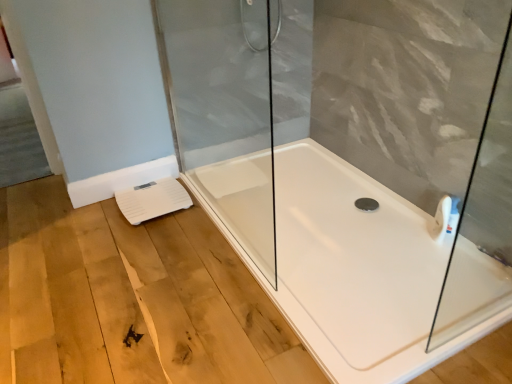
What do you see at coordinates (152, 200) in the screenshot?
I see `white plastic scale at lower left` at bounding box center [152, 200].

Measure the distance between white glossy bathtub at center and camera.

white glossy bathtub at center is 4.17 feet away from camera.

Describe the element at coordinates (223, 111) in the screenshot. I see `transparent glass shower door at center` at that location.

Find the location of `white plastic scale at lower left`. white plastic scale at lower left is located at coordinates (152, 200).

Considering the sizes of transparent glass shower door at center and white glossy bathtub at center in the image, is transparent glass shower door at center wider or thinner than white glossy bathtub at center?

In the image, transparent glass shower door at center appears to be more narrow than white glossy bathtub at center.

Which is closer to the camera, (213,155) or (322,289)?

Point (213,155) appears to be farther away from the viewer than point (322,289).

Is transparent glass shower door at center closer to the viewer compared to white glossy bathtub at center?

That is False.

From the image's perspective, is white plastic scale at lower left on white glossy bathtub at center?

Yes.

What's the angular difference between white plastic scale at lower left and white glossy bathtub at center's facing directions?

The facing directions of white plastic scale at lower left and white glossy bathtub at center are 88.8 degrees apart.

Is white plastic scale at lower left completely or partially outside of white glossy bathtub at center?

Yes, white plastic scale at lower left is not within white glossy bathtub at center.

Who is shorter, white plastic scale at lower left or transparent glass shower door at center?

With less height is white plastic scale at lower left.

What are the coordinates of `lift below the transparent glass shower door at center (from a real-world perspective)` in the screenshot? It's located at (152, 200).

From a real-world perspective, is white plastic scale at lower left positioned above or below transparent glass shower door at center?

white plastic scale at lower left is situated lower than transparent glass shower door at center in the real world.

How distant is white plastic scale at lower left from transparent glass shower door at center?

white plastic scale at lower left and transparent glass shower door at center are 20.19 inches apart.

Is transparent glass shower door at center turned away from white plastic scale at lower left?

Correct, transparent glass shower door at center is looking away from white plastic scale at lower left.

Between transparent glass shower door at center and white plastic scale at lower left, which one has less height?

With less height is white plastic scale at lower left.

Are transparent glass shower door at center and white plastic scale at lower left beside each other?

No, transparent glass shower door at center is not next to white plastic scale at lower left.

From the image's perspective, is transparent glass shower door at center under white plastic scale at lower left?

No, from the image's perspective, transparent glass shower door at center is not beneath white plastic scale at lower left.

From the image's perspective, which one is positioned higher, white glossy bathtub at center or white plastic scale at lower left?

From the image's view, white plastic scale at lower left is above.

Can you see white glossy bathtub at center touching white plastic scale at lower left?

No.

Is white glossy bathtub at center surrounding white plastic scale at lower left?

No, white plastic scale at lower left is located outside of white glossy bathtub at center.

Looking at this image, considering the positions of objects white glossy bathtub at center and white plastic scale at lower left in the image provided, who is more to the right, white glossy bathtub at center or white plastic scale at lower left?

Positioned to the right is white glossy bathtub at center.

Considering the sizes of objects white glossy bathtub at center and transparent glass shower door at center in the image provided, who is smaller, white glossy bathtub at center or transparent glass shower door at center?

Smaller between the two is transparent glass shower door at center.

What's the angular difference between white glossy bathtub at center and transparent glass shower door at center's facing directions?

white glossy bathtub at center and transparent glass shower door at center are facing 0.256 degrees away from each other.

In the scene shown: Between white glossy bathtub at center and transparent glass shower door at center, which one is positioned behind?

transparent glass shower door at center.

Identify the location of bathtub below the transparent glass shower door at center (from a real-world perspective). (352, 269).

Where is `lift that is behind the white glossy bathtub at center`? The width and height of the screenshot is (512, 384). lift that is behind the white glossy bathtub at center is located at coordinates (152, 200).

Consider the image. Looking at the image, which one is located closer to transparent glass shower door at center, white glossy bathtub at center or white plastic scale at lower left?

Based on the image, white plastic scale at lower left appears to be nearer to transparent glass shower door at center.

Based on their spatial positions, is transparent glass shower door at center or white plastic scale at lower left further from white glossy bathtub at center?

transparent glass shower door at center is further to white glossy bathtub at center.

When comparing their distances from white plastic scale at lower left, does white glossy bathtub at center or transparent glass shower door at center seem further?

white glossy bathtub at center.

Considering their positions, is white plastic scale at lower left positioned further to white glossy bathtub at center than transparent glass shower door at center?

transparent glass shower door at center.

Based on their spatial positions, is white plastic scale at lower left or white glossy bathtub at center further from transparent glass shower door at center?

Among the two, white glossy bathtub at center is located further to transparent glass shower door at center.

Considering their positions, is transparent glass shower door at center positioned further to white plastic scale at lower left than white glossy bathtub at center?

white glossy bathtub at center lies further to white plastic scale at lower left than the other object.

Identify the location of shower door positioned between white glossy bathtub at center and white plastic scale at lower left from near to far. This screenshot has height=384, width=512. (223, 111).